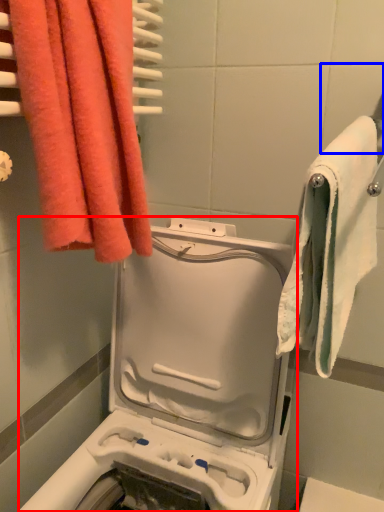
Question: Which object appears closest to the camera in this image, washing machine (highlighted by a red box) or tile (highlighted by a blue box)?

Choices:
 (A) washing machine
 (B) tile

Answer: (A)